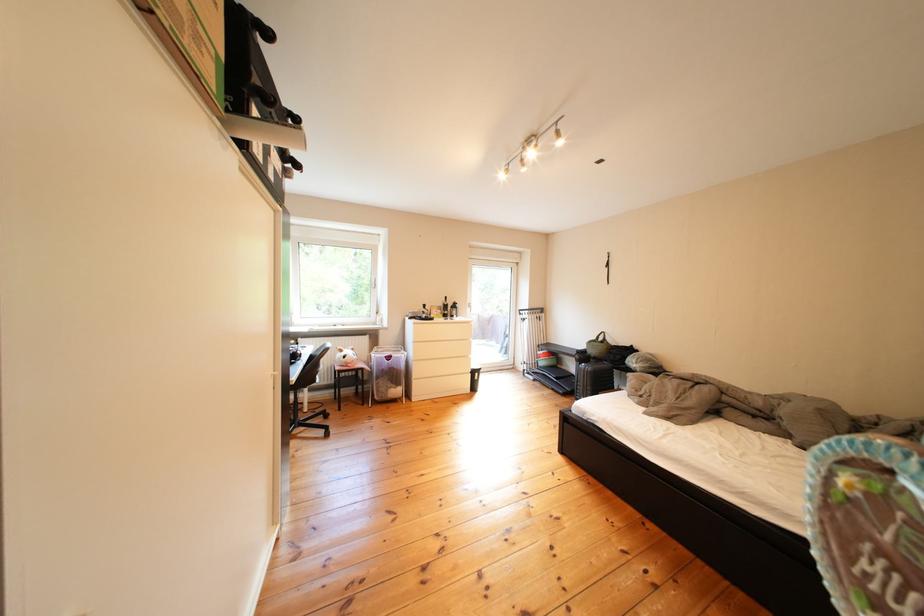
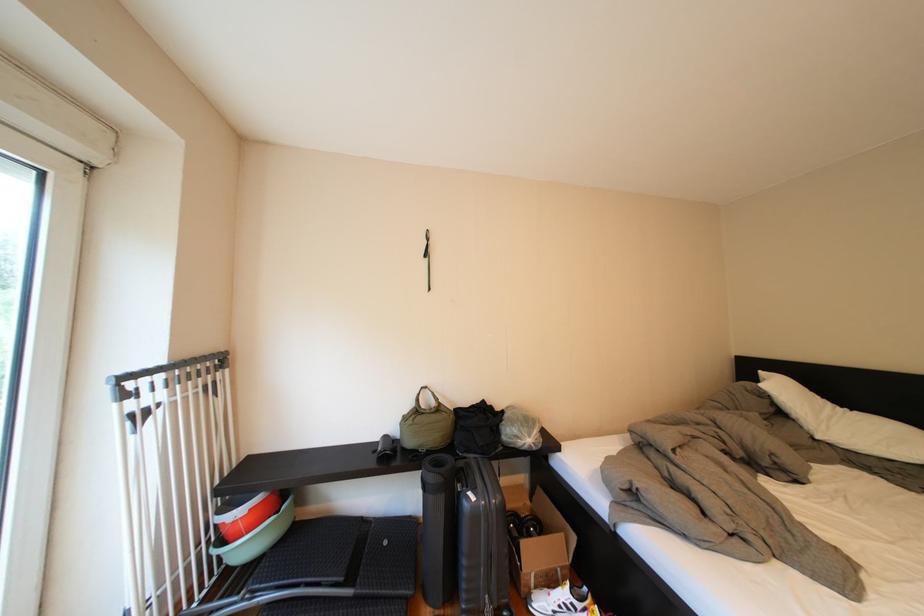
In the second image, find the point that corresponds to point (612, 342) in the first image.

(431, 405)